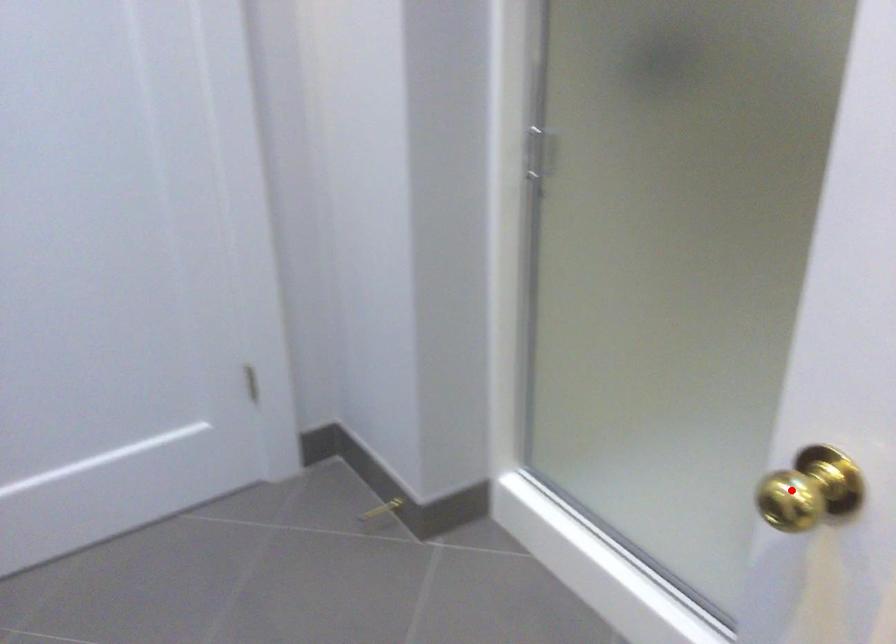
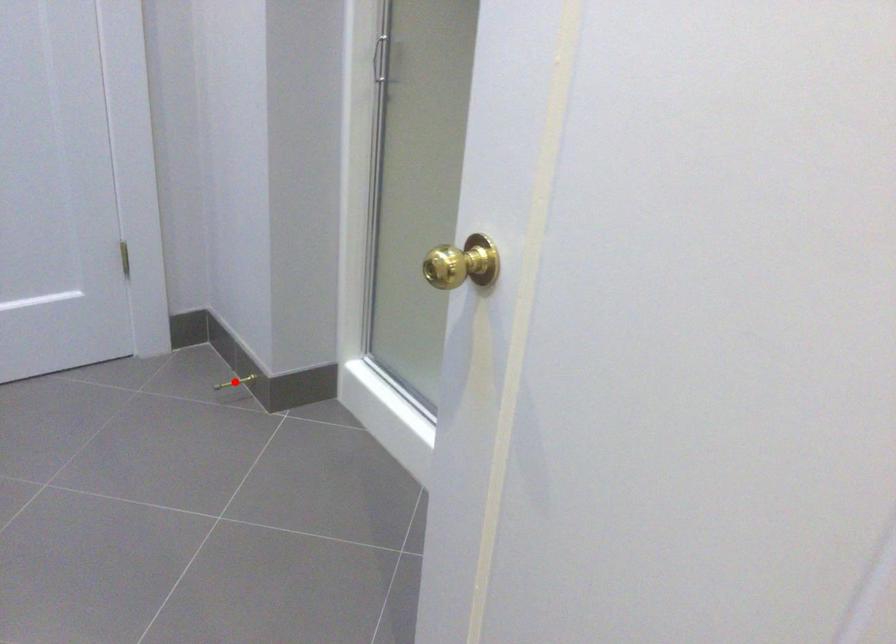
I am providing you with two images of the same scene from different viewpoints. A red point is marked on the first image and another point is marked on the second image. Do the highlighted points in image1 and image2 indicate the same real-world spot?

No